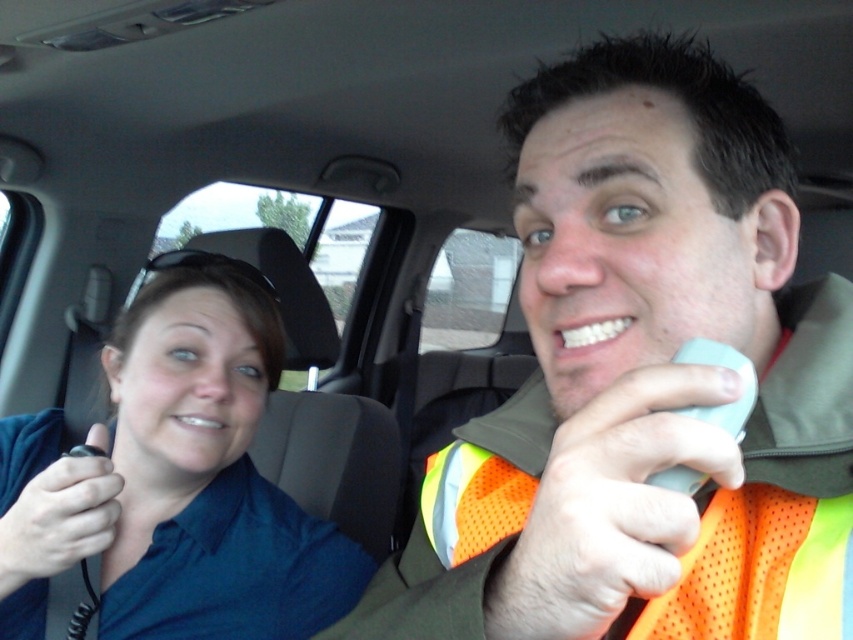
Question: Which of the following is the closest to the observer?

Choices:
 (A) (202, 627)
 (B) (837, 525)

Answer: (B)

Question: Does blue fabric shirt at left lie behind orange mesh safety vest at center?

Choices:
 (A) yes
 (B) no

Answer: (A)

Question: Is blue fabric shirt at left smaller than orange mesh safety vest at center?

Choices:
 (A) yes
 (B) no

Answer: (B)

Question: Which of the following is the farthest from the observer?

Choices:
 (A) blue fabric shirt at left
 (B) orange mesh safety vest at center

Answer: (A)

Question: Is blue fabric shirt at left further to the viewer compared to orange mesh safety vest at center?

Choices:
 (A) yes
 (B) no

Answer: (A)

Question: Among these objects, which one is farthest from the camera?

Choices:
 (A) blue fabric shirt at left
 (B) orange mesh safety vest at center

Answer: (A)